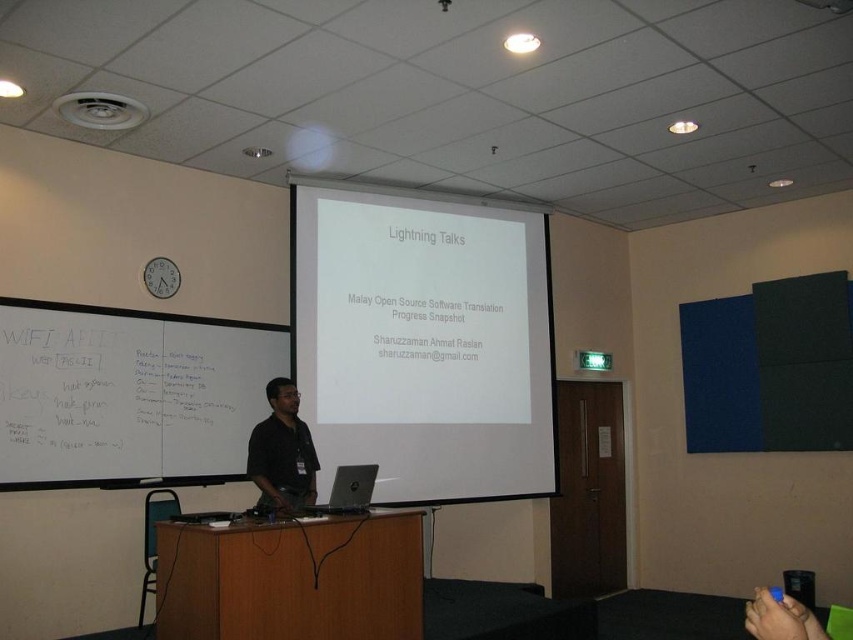
Who is shorter, brown wood podium at center or silver metallic laptop at center?

With less height is silver metallic laptop at center.

The image size is (853, 640). What do you see at coordinates (292, 579) in the screenshot? I see `brown wood podium at center` at bounding box center [292, 579].

At what (x,y) coordinates should I click in order to perform the action: click on brown wood podium at center. Please return your answer as a coordinate pair (x, y). The width and height of the screenshot is (853, 640). Looking at the image, I should click on (292, 579).

Is white matte projection screen at center wider than matte black shirt at center?

Yes, white matte projection screen at center is wider than matte black shirt at center.

At what (x,y) coordinates should I click in order to perform the action: click on white matte projection screen at center. Please return your answer as a coordinate pair (x, y). This screenshot has height=640, width=853. Looking at the image, I should click on (424, 340).

Image resolution: width=853 pixels, height=640 pixels. I want to click on white matte projection screen at center, so (x=424, y=340).

Who is more distant from viewer, (229, 419) or (277, 392)?

The point (229, 419) is more distant.

Is point (219, 429) closer to camera compared to point (293, 445)?

That is False.

Is point (38, 342) less distant than point (260, 492)?

Yes, it is.

The width and height of the screenshot is (853, 640). What are the coordinates of `whiteboard at left` in the screenshot? It's located at (128, 394).